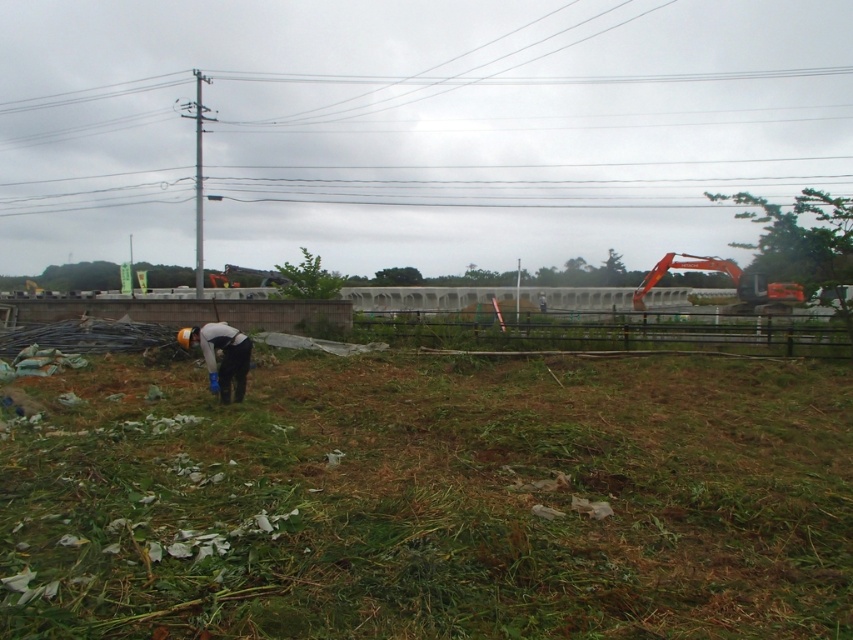
You are standing at the position of the person in the scene. There are two points marked in the image. Which point is closer to you, point (636, 493) or point (219, 397)?

Point (636, 493) is in front of point (219, 397), so it is closer to you.

You are standing at the center of the image and need to locate the green rough grass at lower left. According to the coordinates provided, in which direction should you look to find it?

The green rough grass at lower left is located at coordinates point [431,500]. Since you are at the center, you should look to the lower left direction to find it.

You are standing at point (431,500) in the scene. What do you see immediately to your lower left?

At point (431,500), the green rough grass at lower left is located immediately to the lower left.